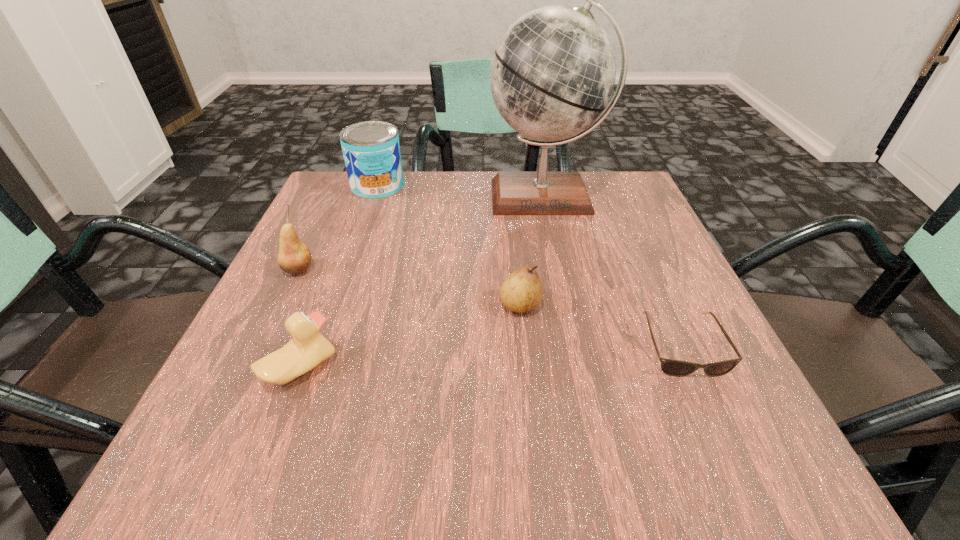
Locate an element on the screen. Image resolution: width=960 pixels, height=540 pixels. sunglasses located in the right edge section of the desktop is located at coordinates (677, 368).

Find the location of a particular element. The image size is (960, 540). object at the far left corner is located at coordinates (371, 150).

At what (x,y) coordinates should I click in order to perform the action: click on object that is at the far right corner. Please return your answer as a coordinate pair (x, y). Looking at the image, I should click on (553, 72).

In order to click on free region at the far edge of the desktop in this screenshot , I will do `click(422, 178)`.

Locate an element on the screen. This screenshot has height=540, width=960. vacant area at the near edge is located at coordinates (606, 467).

This screenshot has height=540, width=960. I want to click on free space at the left edge of the desktop, so click(x=342, y=277).

Locate an element on the screen. vacant region at the right edge is located at coordinates (636, 317).

The image size is (960, 540). Identify the location of free space at the far left corner of the desktop. (336, 194).

In the image, there is a desktop. Where is `free space at the near left corner`? The width and height of the screenshot is (960, 540). free space at the near left corner is located at coordinates (282, 447).

Find the location of a particular element. Image resolution: width=960 pixels, height=540 pixels. free space at the far right corner of the desktop is located at coordinates (626, 181).